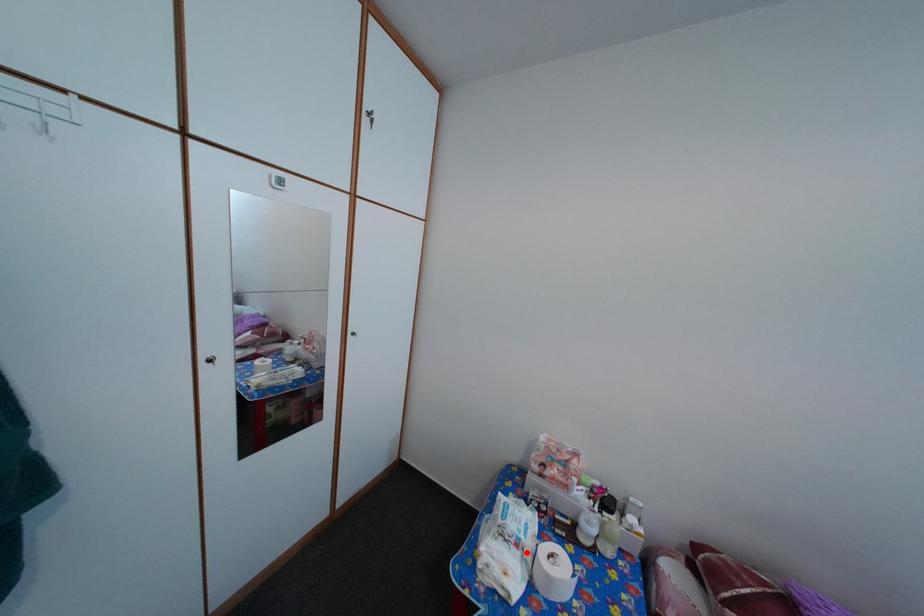
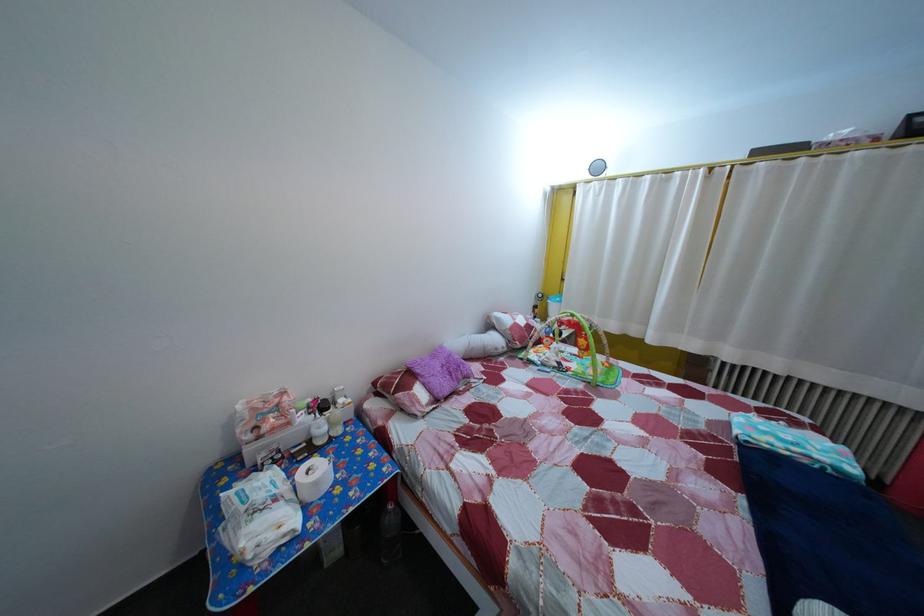
Question: I am providing you with two images of the same scene from different viewpoints. Given a red point in image1, look at the same physical point in image2. Is it:

Choices:
 (A) Closer to the viewpoint
 (B) Farther from the viewpoint

Answer: (A)